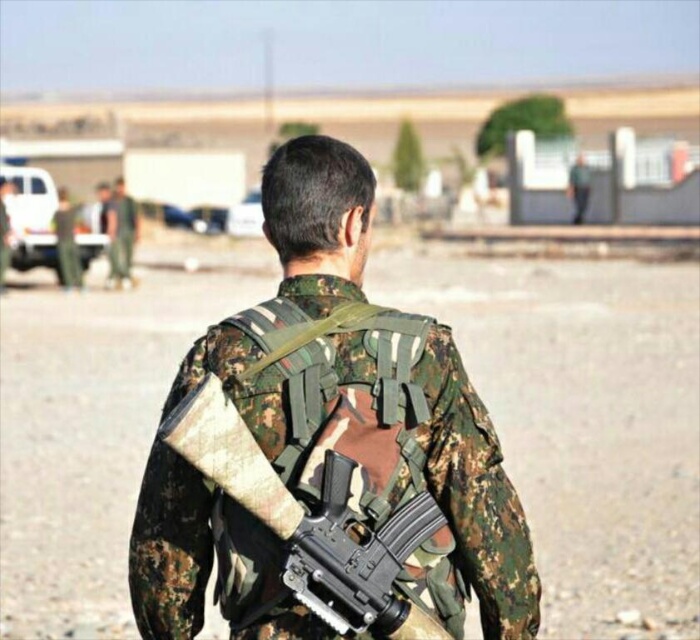
Does camouflage fabric gun at back have a smaller size compared to camouflage uniform at center?

Indeed, camouflage fabric gun at back has a smaller size compared to camouflage uniform at center.

Does camouflage fabric gun at back have a greater height compared to camouflage uniform at center?

Indeed, camouflage fabric gun at back has a greater height compared to camouflage uniform at center.

Does point (386, 589) come farther from viewer compared to point (132, 228)?

No, (386, 589) is closer to viewer.

In order to click on camouflage fabric gun at back in this screenshot , I will do `click(312, 522)`.

Can you confirm if camouflage fabric backpack at center is taller than camouflage fabric gun at back?

Correct, camouflage fabric backpack at center is much taller as camouflage fabric gun at back.

Who is positioned more to the left, camouflage fabric backpack at center or camouflage fabric gun at back?

From the viewer's perspective, camouflage fabric gun at back appears more on the left side.

The image size is (700, 640). What do you see at coordinates (371, 394) in the screenshot?
I see `camouflage fabric backpack at center` at bounding box center [371, 394].

Identify the location of camouflage fabric backpack at center. (371, 394).

Between camouflage fabric backpack at center and camouflage uniform at center, which one is positioned higher?

camouflage uniform at center is higher up.

Does camouflage fabric backpack at center have a lesser width compared to camouflage uniform at center?

No, camouflage fabric backpack at center is not thinner than camouflage uniform at center.

You are a GUI agent. You are given a task and a screenshot of the screen. Output one action in this format:
    pyautogui.click(x=<x>, y=<y>)
    Task: Click on the camouflage fabric backpack at center
    This screenshot has height=640, width=700.
    Given the screenshot: What is the action you would take?
    pyautogui.click(x=371, y=394)

At what (x,y) coordinates should I click in order to perform the action: click on camouflage fabric backpack at center. Please return your answer as a coordinate pair (x, y). Looking at the image, I should click on (371, 394).